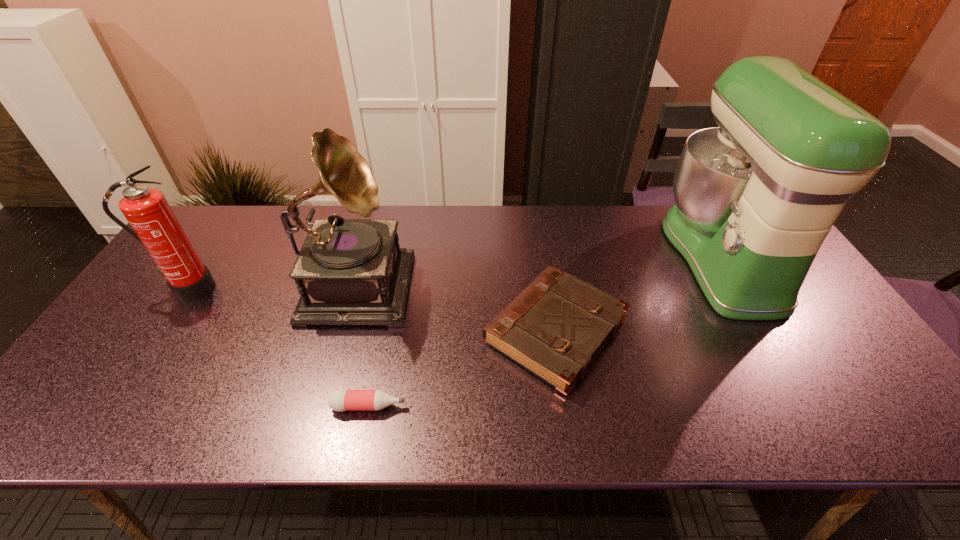
Where is `vacant space positioned 0.240m on the horn of the record player`? The image size is (960, 540). vacant space positioned 0.240m on the horn of the record player is located at coordinates (494, 280).

Where is `vacant space located 0.260m on the front-facing side of the leftmost object`? The width and height of the screenshot is (960, 540). vacant space located 0.260m on the front-facing side of the leftmost object is located at coordinates (124, 384).

Where is `free spot located 0.190m on the right of the hardback book`? This screenshot has height=540, width=960. free spot located 0.190m on the right of the hardback book is located at coordinates (703, 332).

The width and height of the screenshot is (960, 540). What are the coordinates of `blank area located 0.270m with the cap open on the bottle` in the screenshot? It's located at (527, 406).

Locate an element on the screen. This screenshot has height=540, width=960. mixer positioned at the far edge is located at coordinates (755, 198).

In order to click on record player that is at the far edge in this screenshot , I will do `click(349, 271)`.

Locate an element on the screen. This screenshot has width=960, height=540. object that is at the near edge is located at coordinates (341, 400).

I want to click on object located in the left edge section of the desktop, so click(147, 211).

Locate an element on the screen. This screenshot has height=540, width=960. object that is at the right edge is located at coordinates (755, 198).

Identify the location of object that is at the far right corner. (755, 198).